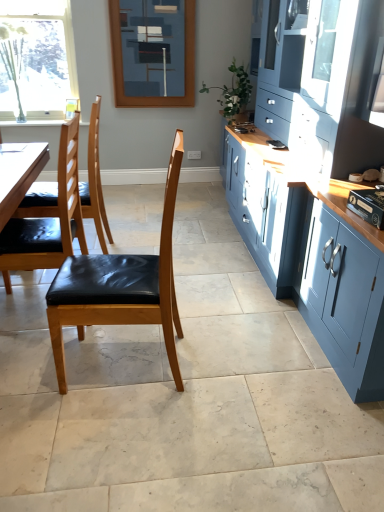
Question: From the image's perspective, relative to blue painted wood frame at upper center, is matte black chair at left, placed as the second chair when sorted from front to back, above or below?

Choices:
 (A) below
 (B) above

Answer: (A)

Question: Based on their positions, is matte black chair at left, placed as the second chair when sorted from front to back, located to the left or right of blue painted wood frame at upper center?

Choices:
 (A) left
 (B) right

Answer: (A)

Question: Considering the real-world distances, which object is closest to the blue painted wood frame at upper center?

Choices:
 (A) matte blue cabinet at right
 (B) matte black chair at left, arranged as the 2th chair when viewed from the back
 (C) matte wood chair at left, which is the first chair from front to back
 (D) clear glass window at upper left
 (E) black leather chair at left, positioned as the 3th chair in front-to-back order

Answer: (D)

Question: Which of these objects is positioned closest to the blue painted wood frame at upper center?

Choices:
 (A) matte blue cabinet at right
 (B) black leather chair at left, positioned as the 3th chair in front-to-back order
 (C) clear glass window at upper left
 (D) matte wood chair at left, which is the first chair from front to back
 (E) matte black chair at left, arranged as the 2th chair when viewed from the back

Answer: (C)